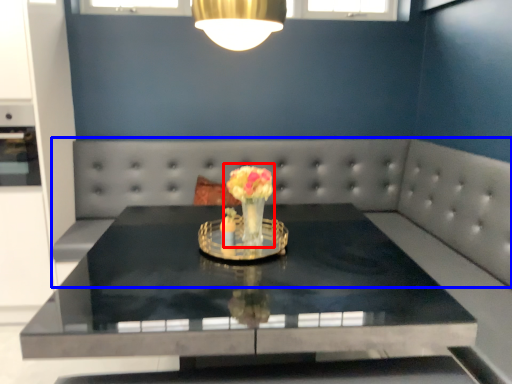
Question: Which object appears closest to the camera in this image, floral arrangement (highlighted by a red box) or couch (highlighted by a blue box)?

Choices:
 (A) floral arrangement
 (B) couch

Answer: (A)